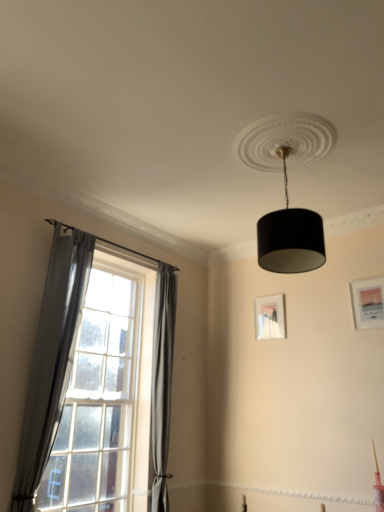
Question: Should I look upward or downward to see clear glass window at left?

Choices:
 (A) down
 (B) up

Answer: (A)

Question: Considering the relative positions of clear glass window at left and black textured lampshade at upper center in the image provided, is clear glass window at left in front of black textured lampshade at upper center?

Choices:
 (A) no
 (B) yes

Answer: (A)

Question: Is clear glass window at left oriented away from black textured lampshade at upper center?

Choices:
 (A) no
 (B) yes

Answer: (A)

Question: Is clear glass window at left to the left of black textured lampshade at upper center from the viewer's perspective?

Choices:
 (A) yes
 (B) no

Answer: (A)

Question: Considering the relative sizes of clear glass window at left and black textured lampshade at upper center in the image provided, is clear glass window at left wider than black textured lampshade at upper center?

Choices:
 (A) yes
 (B) no

Answer: (B)

Question: Can you confirm if clear glass window at left is bigger than black textured lampshade at upper center?

Choices:
 (A) yes
 (B) no

Answer: (A)

Question: From the image's perspective, is clear glass window at left located beneath black textured lampshade at upper center?

Choices:
 (A) yes
 (B) no

Answer: (A)

Question: Does gray fabric curtain at left, the 2th curtain positioned from the front, have a larger size compared to black textured lampshade at upper center?

Choices:
 (A) yes
 (B) no

Answer: (B)

Question: From a real-world perspective, does gray fabric curtain at left, which ranks as the second curtain in left-to-right order, stand above black textured lampshade at upper center?

Choices:
 (A) no
 (B) yes

Answer: (A)

Question: Is the depth of gray fabric curtain at left, acting as the 1th curtain starting from the back, less than that of black textured lampshade at upper center?

Choices:
 (A) no
 (B) yes

Answer: (A)

Question: Does gray fabric curtain at left, placed as the 1th curtain when sorted from right to left, have a greater height compared to black textured lampshade at upper center?

Choices:
 (A) yes
 (B) no

Answer: (A)

Question: Considering the relative sizes of gray fabric curtain at left, acting as the 1th curtain starting from the back, and black textured lampshade at upper center in the image provided, is gray fabric curtain at left, acting as the 1th curtain starting from the back, smaller than black textured lampshade at upper center?

Choices:
 (A) yes
 (B) no

Answer: (A)

Question: From the image's perspective, does gray fabric curtain at left, acting as the 1th curtain starting from the back, appear lower than black textured lampshade at upper center?

Choices:
 (A) yes
 (B) no

Answer: (A)

Question: Can you confirm if matte white picture frame at center, which ranks as the second picture frame in front-to-back order, is thinner than gray fabric curtain at left, which is the second curtain from back to front?

Choices:
 (A) yes
 (B) no

Answer: (A)